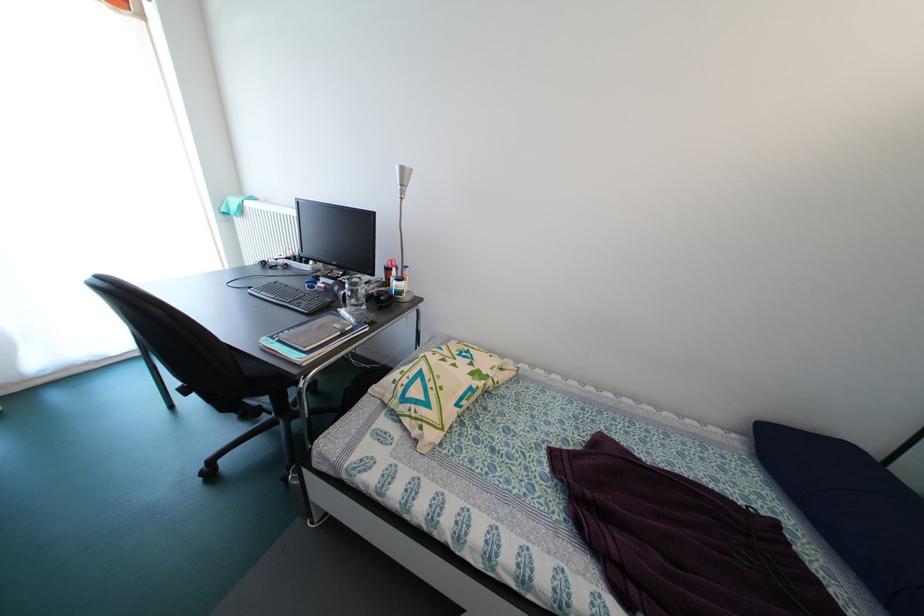
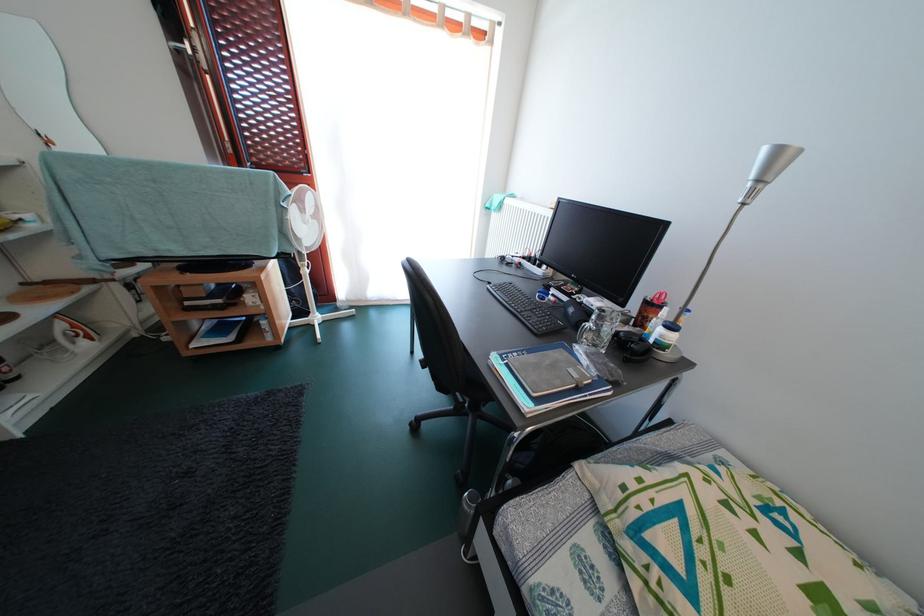
Locate, in the second image, the point that corresponds to pixel 362 310 in the first image.

(602, 351)